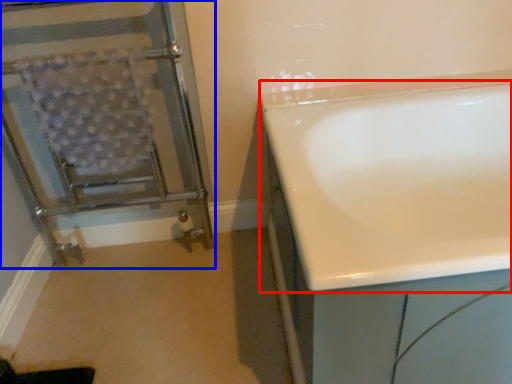
Question: Which object appears closest to the camera in this image, bathtub (highlighted by a red box) or screen door (highlighted by a blue box)?

Choices:
 (A) bathtub
 (B) screen door

Answer: (A)